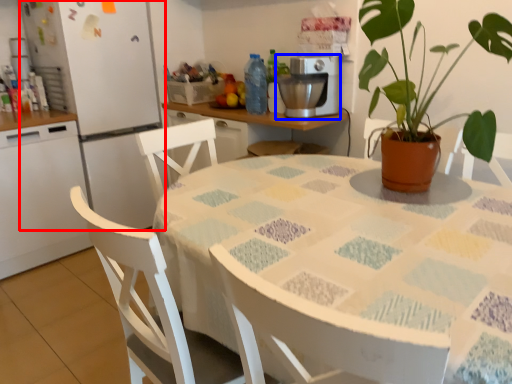
Question: Which object is further to the camera taking this photo, fridge (highlighted by a red box) or coffee machine (highlighted by a blue box)?

Choices:
 (A) fridge
 (B) coffee machine

Answer: (A)